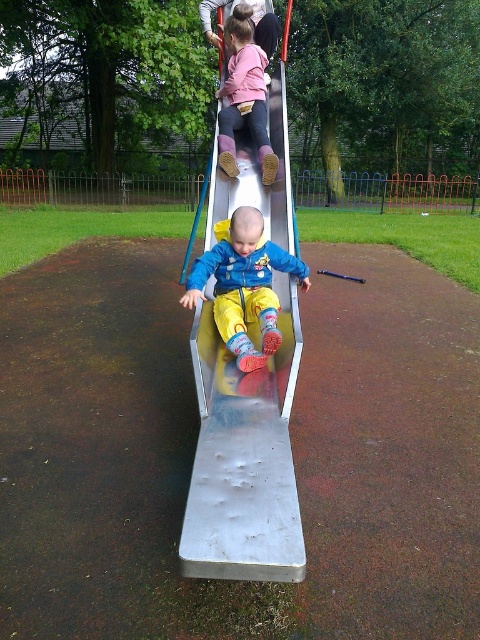
Question: Which of the following is the closest to the observer?

Choices:
 (A) (211, 259)
 (B) (233, 70)
 (C) (276, 529)

Answer: (C)

Question: Among these points, which one is nearest to the camera?

Choices:
 (A) (210, 317)
 (B) (254, 224)
 (C) (244, 109)

Answer: (B)

Question: Is metallic smooth slide at center thinner than blue fleece jacket at center?

Choices:
 (A) yes
 (B) no

Answer: (A)

Question: Which of the following is the closest to the observer?

Choices:
 (A) (204, 253)
 (B) (235, 168)

Answer: (A)

Question: In this image, where is metallic smooth slide at center located relative to blue fleece jacket at center?

Choices:
 (A) right
 (B) left

Answer: (B)

Question: Observing the image, what is the correct spatial positioning of metallic smooth slide at center in reference to matte pink sweater at upper center?

Choices:
 (A) above
 (B) below

Answer: (B)